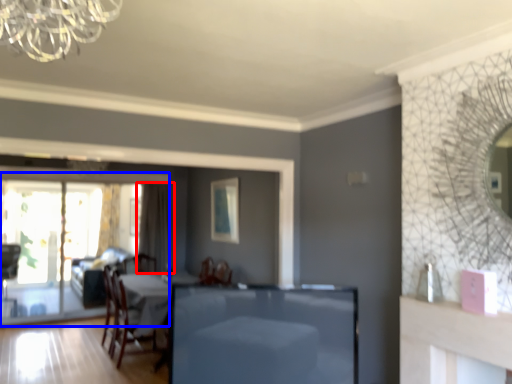
Question: Which object is closer to the camera taking this photo, curtain (highlighted by a red box) or screen door (highlighted by a blue box)?

Choices:
 (A) curtain
 (B) screen door

Answer: (B)